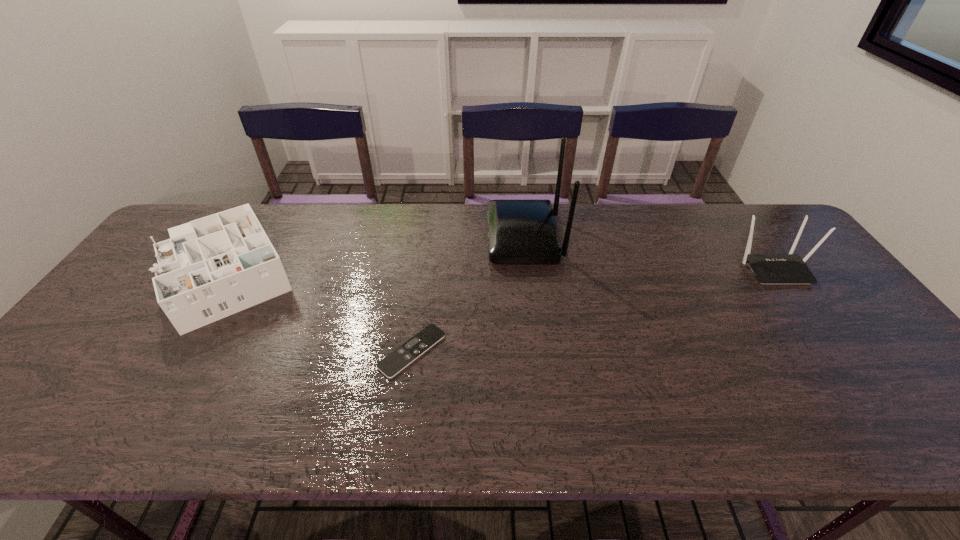
Image resolution: width=960 pixels, height=540 pixels. I want to click on vacant area between the leftmost object and the shorter router, so click(497, 269).

Find the location of a particular element. This screenshot has width=960, height=540. free space that is in between the taller router and the right router is located at coordinates (649, 253).

Locate an element on the screen. free area in between the right router and the dollhouse is located at coordinates (497, 269).

This screenshot has width=960, height=540. I want to click on free space that is in between the third tallest object and the shorter router, so click(x=497, y=269).

This screenshot has height=540, width=960. In order to click on object that is the second closest to the dollhouse in this screenshot , I will do `click(519, 231)`.

Locate which object is the third closest to the remote control. Please provide its 2D coordinates. Your answer should be formatted as a tuple, i.e. [(x, y)], where the tuple contains the x and y coordinates of a point satisfying the conditions above.

[(789, 268)]

This screenshot has height=540, width=960. Find the location of `vacant space that satisfies the following two spatial constraints: 1. on the front-facing side of the third object from left to right; 2. on the front side of the second object from left to right`. vacant space that satisfies the following two spatial constraints: 1. on the front-facing side of the third object from left to right; 2. on the front side of the second object from left to right is located at coordinates (538, 351).

This screenshot has width=960, height=540. In order to click on free space that satisfies the following two spatial constraints: 1. on the front-facing side of the left router; 2. on the front side of the third tallest object in this screenshot , I will do `click(528, 270)`.

Find the location of a particular element. free location that satisfies the following two spatial constraints: 1. on the front-facing side of the taller router; 2. on the front side of the remote control is located at coordinates (538, 351).